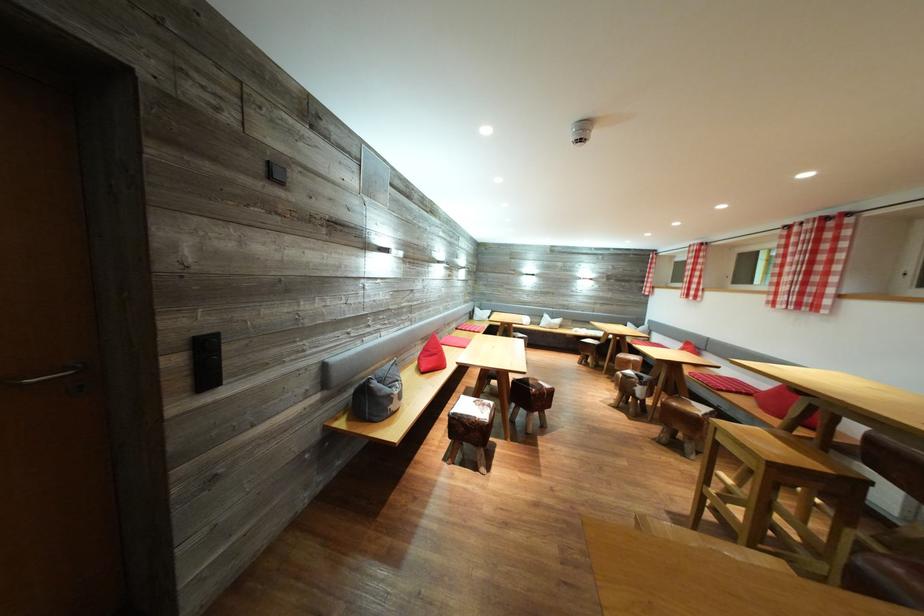
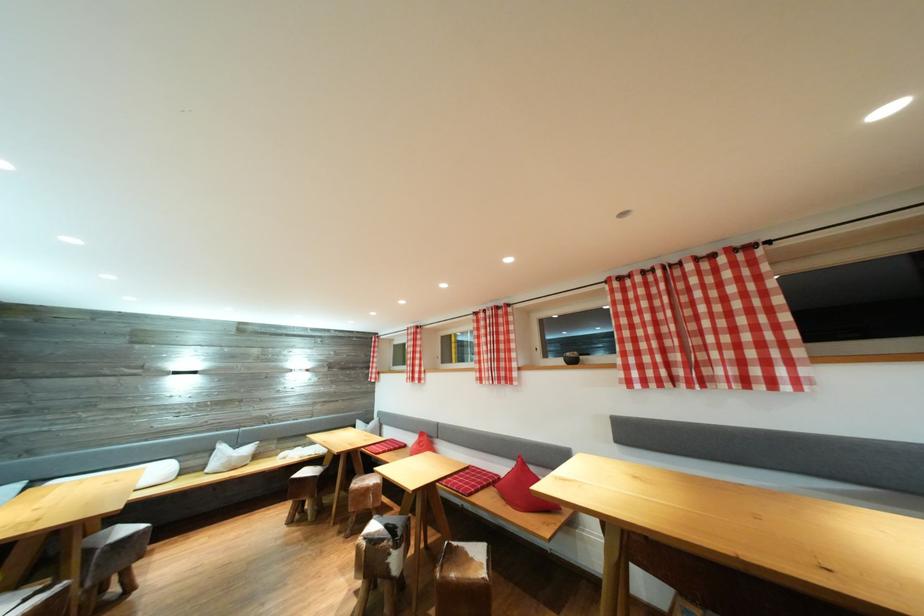
Find the pixel in the second image that matches [631,381] in the first image.

(377, 546)